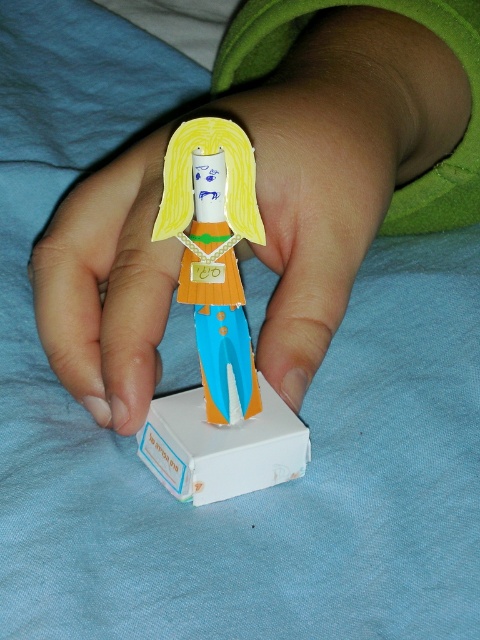
Can you confirm if matte paper doll at center is bigger than white cardboard box at center?

Yes, matte paper doll at center is bigger than white cardboard box at center.

How much distance is there between matte paper doll at center and white cardboard box at center?

matte paper doll at center and white cardboard box at center are 7.62 inches apart.

Which is in front, point (286, 385) or point (285, 438)?

Point (285, 438) is in front.

Locate an element on the screen. This screenshot has height=640, width=480. matte paper doll at center is located at coordinates (340, 160).

Can you confirm if cardboard doll at center is positioned to the right of white cardboard box at center?

Incorrect, cardboard doll at center is not on the right side of white cardboard box at center.

How far apart are cardboard doll at center and white cardboard box at center?

cardboard doll at center is 1.79 inches away from white cardboard box at center.

Is point (195, 422) behind point (230, 444)?

Yes, point (195, 422) is behind point (230, 444).

Find the location of a particular element. The image size is (480, 640). cardboard doll at center is located at coordinates (217, 328).

Is matte paper doll at center positioned behind cardboard doll at center?

Yes, matte paper doll at center is further from the viewer.

Does point (419, 60) come in front of point (151, 456)?

No, it is not.

What do you see at coordinates (340, 160) in the screenshot? I see `matte paper doll at center` at bounding box center [340, 160].

Where is `matte paper doll at center`? This screenshot has width=480, height=640. matte paper doll at center is located at coordinates (340, 160).